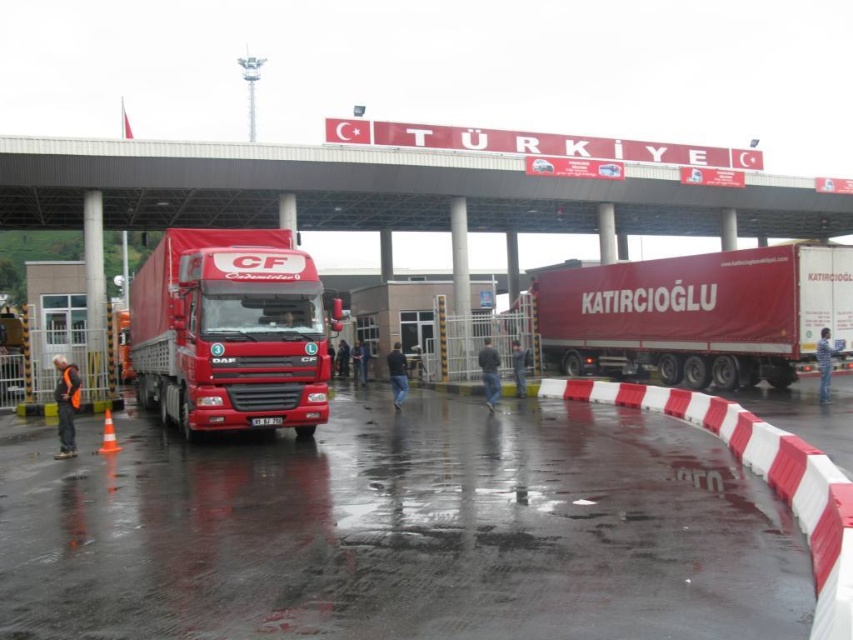
Question: Which point is farther from the camera taking this photo?

Choices:
 (A) (254, 211)
 (B) (138, 384)

Answer: (A)

Question: Based on their relative distances, which object is nearer to the shiny red truck at center?

Choices:
 (A) concrete bridge at upper center
 (B) matte red truck at right

Answer: (A)

Question: Does concrete bridge at upper center appear on the right side of matte red truck at right?

Choices:
 (A) no
 (B) yes

Answer: (A)

Question: Does concrete bridge at upper center appear over shiny red truck at center?

Choices:
 (A) no
 (B) yes

Answer: (B)

Question: Does matte red truck at right appear over shiny red truck at center?

Choices:
 (A) yes
 (B) no

Answer: (B)

Question: Considering the real-world distances, which object is farthest from the shiny red truck at center?

Choices:
 (A) concrete bridge at upper center
 (B) matte red truck at right

Answer: (B)